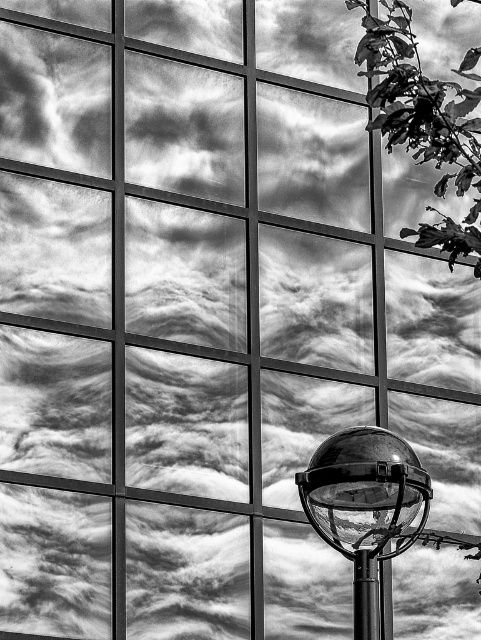
Does polished glass globe at center appear on the left side of polished metal pole at lower right?

Incorrect, polished glass globe at center is not on the left side of polished metal pole at lower right.

Between point (357, 464) and point (365, 634), which one is positioned in front?

Positioned in front is point (357, 464).

Where is `polished glass globe at center`? This screenshot has width=481, height=640. polished glass globe at center is located at coordinates (365, 506).